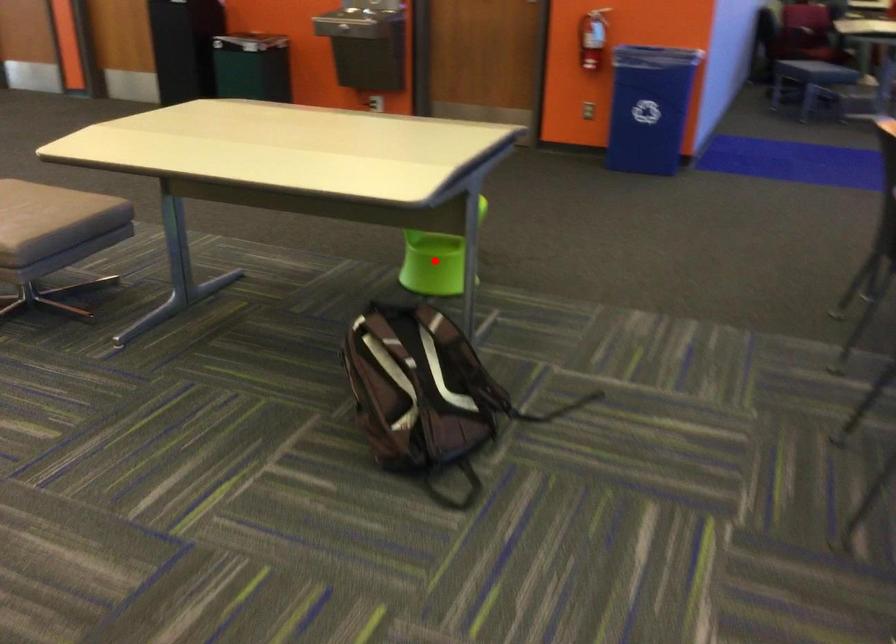
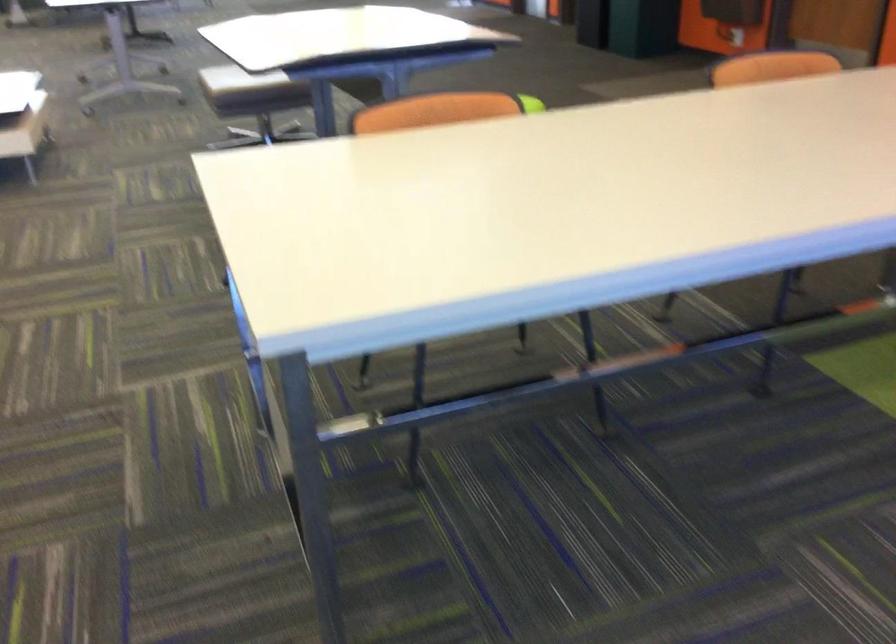
Question: I am providing you with two images of the same scene from different viewpoints. A red point is marked on the first image. Is the red point's position out of view in image 2?

Choices:
 (A) Yes
 (B) No

Answer: (A)